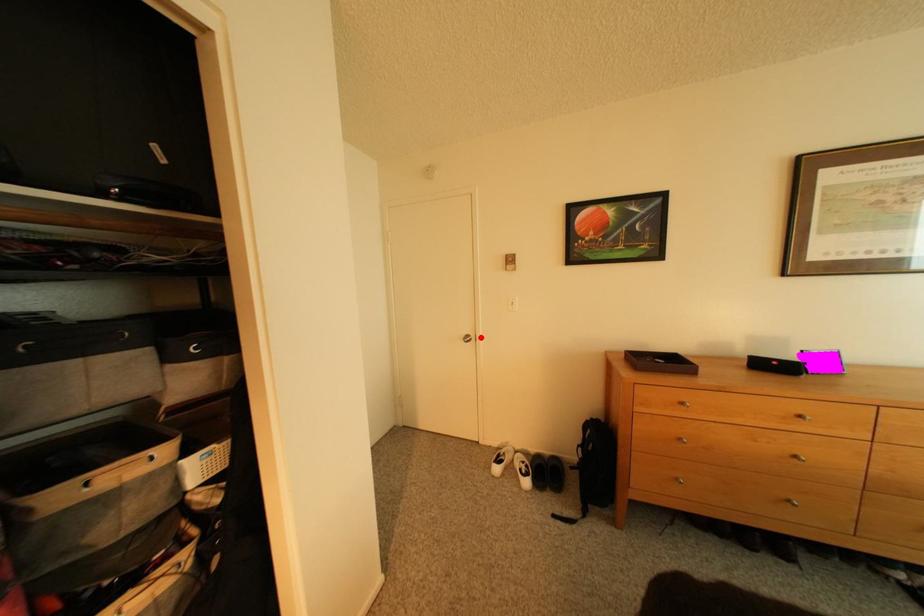
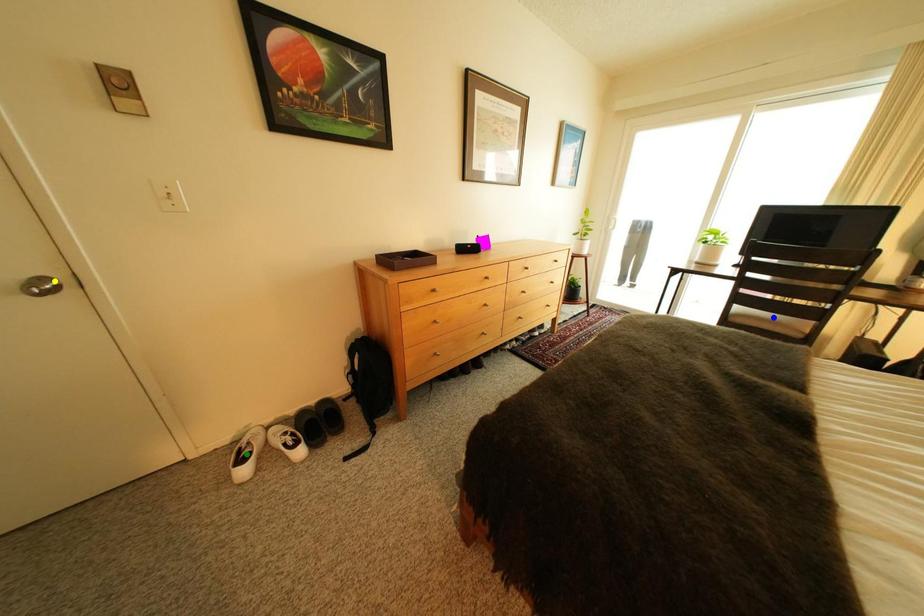
Question: I am providing you with two images of the same scene from different viewpoints. A red point is marked on the first image. You are given multiple points on the second image. Which spot in image 2 lines up with the point in image 1?

Choices:
 (A) blue point
 (B) yellow point
 (C) green point

Answer: (B)